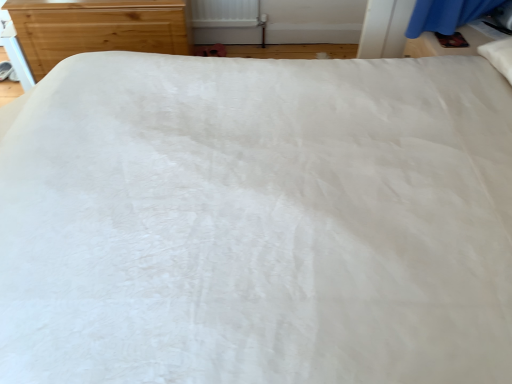
The image size is (512, 384). What do you see at coordinates (97, 28) in the screenshot?
I see `light brown wood at left` at bounding box center [97, 28].

The height and width of the screenshot is (384, 512). I want to click on light brown wood at left, so click(97, 28).

Identify the location of light brown wood at left. This screenshot has width=512, height=384. (97, 28).